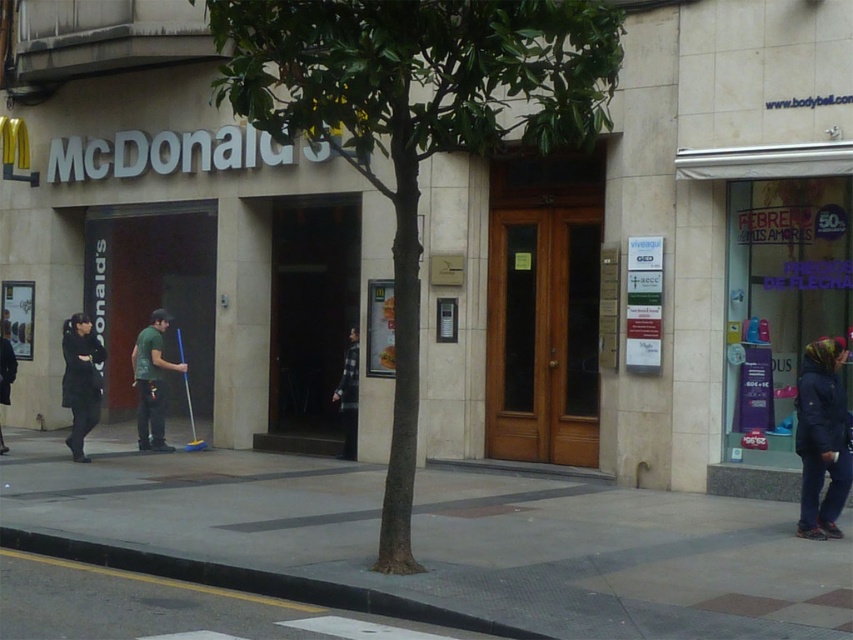
Does green leafy tree at center come behind flannel shirt at center?

No, green leafy tree at center is closer to the viewer.

The width and height of the screenshot is (853, 640). Describe the element at coordinates (416, 122) in the screenshot. I see `green leafy tree at center` at that location.

Locate an element on the screen. The height and width of the screenshot is (640, 853). green leafy tree at center is located at coordinates (416, 122).

Is point (647, 586) more distant than point (844, 448)?

No, (647, 586) is closer to viewer.

Is point (608, 524) more distant than point (827, 518)?

Yes, point (608, 524) is behind point (827, 518).

Locate an element on the screen. Image resolution: width=853 pixels, height=640 pixels. smooth concrete pavement at center is located at coordinates (456, 538).

You are a GUI agent. You are given a task and a screenshot of the screen. Output one action in this format:
    pyautogui.click(x=<x>, y=<y>)
    Task: Click on the dark blue jacket at lower right
    This screenshot has width=853, height=640.
    Given the screenshot: What is the action you would take?
    pyautogui.click(x=821, y=436)

Between dark blue jacket at lower right and flannel shirt at center, which one is positioned higher?

flannel shirt at center is above.

Is point (838, 496) positioned in front of point (349, 352)?

Yes, it is.

Identify the location of dark blue jacket at lower right. (821, 436).